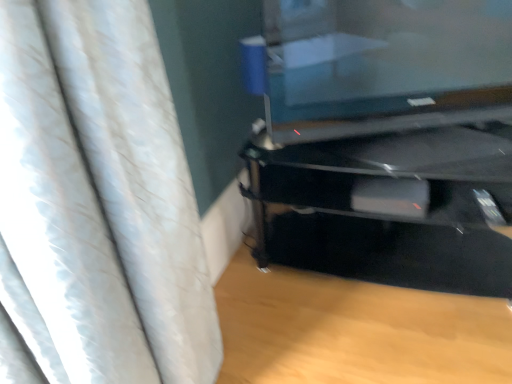
Locate an element on the screen. This screenshot has width=512, height=384. matte black tv at upper right is located at coordinates (385, 139).

From the picture: Measure the distance between point (346, 30) and camera.

They are 5.10 feet apart.

The height and width of the screenshot is (384, 512). Describe the element at coordinates (385, 139) in the screenshot. I see `matte black tv at upper right` at that location.

Image resolution: width=512 pixels, height=384 pixels. I want to click on matte black tv at upper right, so click(385, 139).